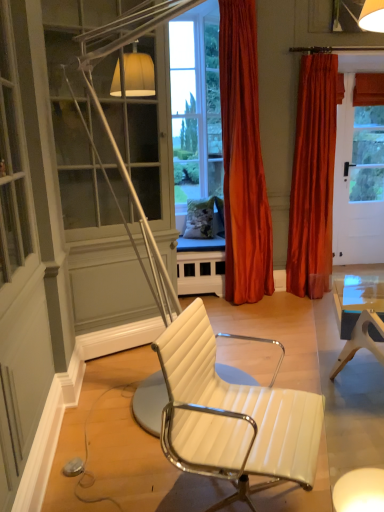
Question: Considering the relative sizes of satin orange curtain at center, arranged as the 2th curtain when viewed from the right, and velvet orange curtain at right, which ranks as the 2th curtain in left-to-right order, in the image provided, is satin orange curtain at center, arranged as the 2th curtain when viewed from the right, taller than velvet orange curtain at right, which ranks as the 2th curtain in left-to-right order,?

Choices:
 (A) no
 (B) yes

Answer: (B)

Question: Is velvet orange curtain at right, the first curtain when ordered from right to left, at the back of satin orange curtain at center, arranged as the 2th curtain when viewed from the right?

Choices:
 (A) no
 (B) yes

Answer: (A)

Question: From the image's perspective, is satin orange curtain at center, positioned as the first curtain in left-to-right order, located above velvet orange curtain at right, the first curtain when ordered from right to left?

Choices:
 (A) no
 (B) yes

Answer: (B)

Question: Is satin orange curtain at center, arranged as the 2th curtain when viewed from the right, wider than velvet orange curtain at right, the first curtain when ordered from right to left?

Choices:
 (A) no
 (B) yes

Answer: (B)

Question: Is satin orange curtain at center, positioned as the first curtain in left-to-right order, shorter than velvet orange curtain at right, which ranks as the 2th curtain in left-to-right order?

Choices:
 (A) yes
 (B) no

Answer: (B)

Question: Looking at their shapes, would you say velvet orange curtain at right, which ranks as the 2th curtain in left-to-right order, is wider or thinner than satin orange curtain at center, positioned as the first curtain in left-to-right order?

Choices:
 (A) thin
 (B) wide

Answer: (A)

Question: Based on their positions, is velvet orange curtain at right, which ranks as the 2th curtain in left-to-right order, located to the left or right of satin orange curtain at center, positioned as the first curtain in left-to-right order?

Choices:
 (A) right
 (B) left

Answer: (A)

Question: Based on their sizes in the image, would you say velvet orange curtain at right, which ranks as the 2th curtain in left-to-right order, is bigger or smaller than satin orange curtain at center, positioned as the first curtain in left-to-right order?

Choices:
 (A) big
 (B) small

Answer: (B)

Question: From a real-world perspective, is velvet orange curtain at right, which ranks as the 2th curtain in left-to-right order, above or below satin orange curtain at center, arranged as the 2th curtain when viewed from the right?

Choices:
 (A) above
 (B) below

Answer: (B)

Question: Is point (235, 287) positioned closer to the camera than point (309, 451)?

Choices:
 (A) closer
 (B) farther

Answer: (B)

Question: Is satin orange curtain at center, positioned as the first curtain in left-to-right order, to the left or to the right of white leather chair at center in the image?

Choices:
 (A) right
 (B) left

Answer: (A)

Question: From the image's perspective, is satin orange curtain at center, arranged as the 2th curtain when viewed from the right, positioned above or below white leather chair at center?

Choices:
 (A) above
 (B) below

Answer: (A)

Question: From a real-world perspective, is satin orange curtain at center, positioned as the first curtain in left-to-right order, positioned above or below white leather chair at center?

Choices:
 (A) below
 (B) above

Answer: (B)

Question: Looking at the image, does white leather chair at center seem bigger or smaller compared to velvet orange curtain at right, which ranks as the 2th curtain in left-to-right order?

Choices:
 (A) small
 (B) big

Answer: (A)

Question: Is point (316, 463) closer or farther from the camera than point (289, 278)?

Choices:
 (A) farther
 (B) closer

Answer: (B)